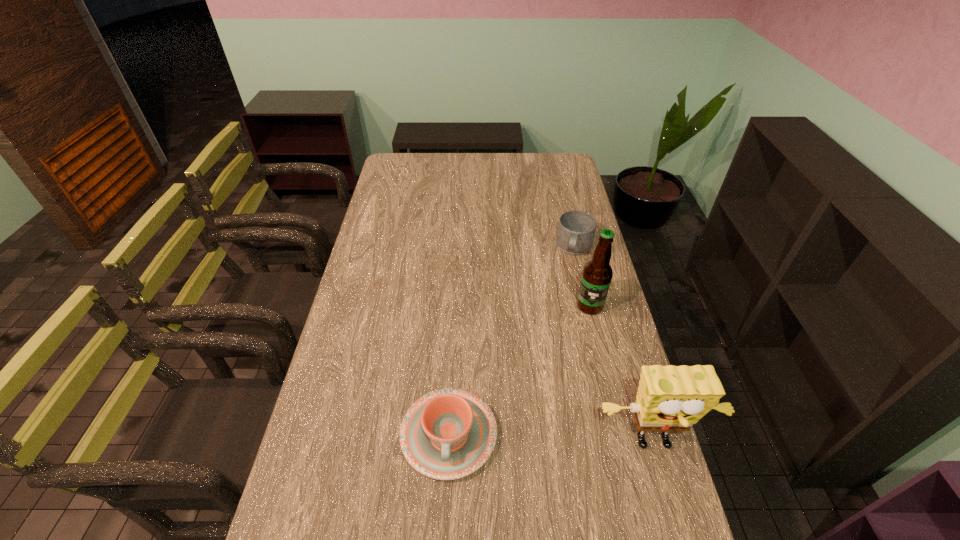
You are a GUI agent. You are given a task and a screenshot of the screen. Output one action in this format:
    pyautogui.click(x=<x>, y=<y>)
    Task: Click on the vacant area at the near left corner of the desktop
    
    Given the screenshot: What is the action you would take?
    pyautogui.click(x=291, y=505)

Image resolution: width=960 pixels, height=540 pixels. What are the coordinates of `free space between the mug and the second tallest object` in the screenshot? It's located at (614, 346).

Image resolution: width=960 pixels, height=540 pixels. I want to click on unoccupied position between the second tallest object and the chinaware, so (552, 440).

Where is `vacant space that is in between the leftmost object and the beer bottle`? The height and width of the screenshot is (540, 960). vacant space that is in between the leftmost object and the beer bottle is located at coordinates (519, 370).

Identify the location of vacant area that lies between the third shortest object and the farthest object. The width and height of the screenshot is (960, 540). (614, 346).

At what (x,y) coordinates should I click in order to perform the action: click on vacant area between the leftmost object and the third nearest object. Please return your answer as a coordinate pair (x, y). This screenshot has height=540, width=960. Looking at the image, I should click on (519, 370).

At what (x,y) coordinates should I click in order to perform the action: click on free space between the second tallest object and the chinaware. Please return your answer as a coordinate pair (x, y). This screenshot has height=540, width=960. Looking at the image, I should click on (552, 440).

Identify the location of free space between the farthest object and the chinaware. This screenshot has height=540, width=960. (512, 341).

Identify the location of free space that is in between the third shortest object and the chinaware. Image resolution: width=960 pixels, height=540 pixels. (552, 440).

Find the location of a particular element. empty space between the leftmost object and the mug is located at coordinates (512, 341).